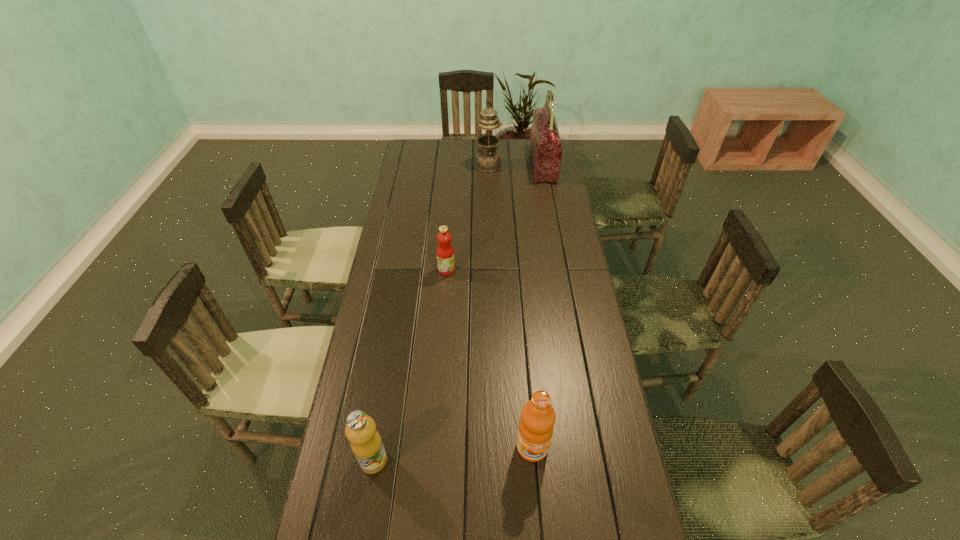
Where is `handbag`? This screenshot has width=960, height=540. handbag is located at coordinates (545, 144).

This screenshot has width=960, height=540. What are the coordinates of `the rightmost object` in the screenshot? It's located at (545, 144).

Locate an element on the screen. The height and width of the screenshot is (540, 960). oil lamp is located at coordinates (488, 160).

At what (x,y) coordinates should I click in order to perform the action: click on the rightmost fruit juice. Please return your answer as a coordinate pair (x, y). This screenshot has width=960, height=540. Looking at the image, I should click on (536, 424).

The image size is (960, 540). I want to click on the leftmost object, so point(366,443).

The height and width of the screenshot is (540, 960). Identify the location of the second object from left to right. (445, 253).

Locate an element on the screen. The image size is (960, 540). the second fruit juice from left to right is located at coordinates (445, 253).

At what (x,y) coordinates should I click in order to perform the action: click on free space located on the front-facing side of the handbag. Please return your answer as a coordinate pair (x, y). Image resolution: width=960 pixels, height=540 pixels. Looking at the image, I should click on (479, 165).

Locate an element on the screen. vacant space located 0.200m on the front-facing side of the handbag is located at coordinates (492, 165).

Locate an element on the screen. The width and height of the screenshot is (960, 540). free region located on the front-facing side of the handbag is located at coordinates (497, 165).